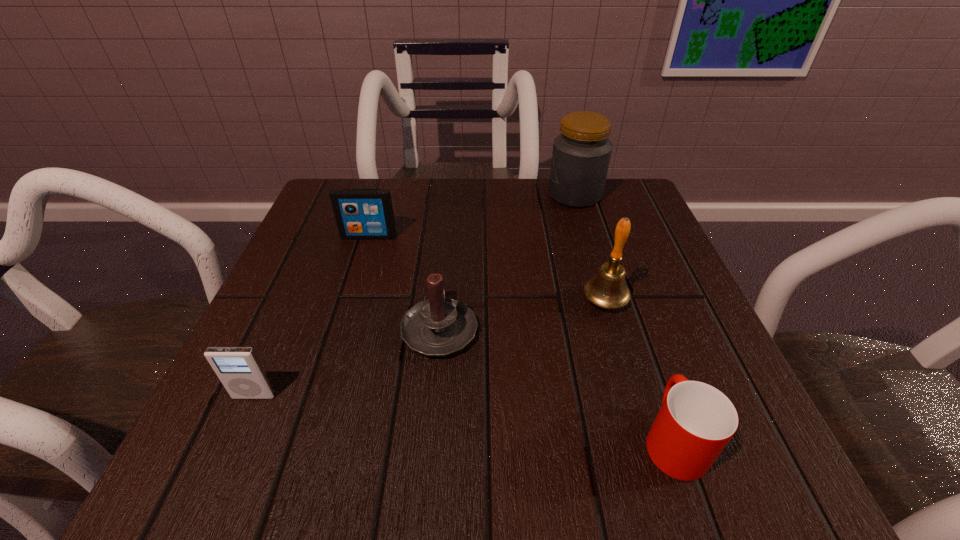
Image resolution: width=960 pixels, height=540 pixels. Find the location of `free space located 0.080m on the surface of the jar near the warning symbol`. free space located 0.080m on the surface of the jar near the warning symbol is located at coordinates (514, 194).

Where is `vacant space located 0.300m on the back of the bell`? This screenshot has width=960, height=540. vacant space located 0.300m on the back of the bell is located at coordinates (574, 197).

At what (x,y) coordinates should I click in order to perform the action: click on free location located 0.300m on the side of the candle with the handle loop. Please return your answer as a coordinate pair (x, y). The height and width of the screenshot is (540, 960). Looking at the image, I should click on (451, 205).

You are a GUI agent. You are given a task and a screenshot of the screen. Output one action in this format:
    pyautogui.click(x=<x>, y=<y>)
    Task: Click on the vacant region located 0.220m on the side of the candle with the handle loop
    
    Given the screenshot: What is the action you would take?
    pyautogui.click(x=449, y=225)

At what (x,y) coordinates should I click in order to perform the action: click on free space located 0.200m on the side of the candle with the handle loop. Please return your answer as a coordinate pair (x, y). Looking at the image, I should click on (448, 231).

Find the location of a particular element. vacant position located on the front screen of the right iPod is located at coordinates (327, 369).

This screenshot has height=540, width=960. I want to click on free space located 0.110m on the front-facing side of the nearer iPod, so click(218, 479).

In order to click on blank space located on the side of the cup with the handle in this screenshot , I will do `click(615, 272)`.

The height and width of the screenshot is (540, 960). In order to click on free spot located 0.110m on the side of the cup with the handle in this screenshot , I will do `click(639, 342)`.

The height and width of the screenshot is (540, 960). What are the coordinates of `free space located on the side of the cup with the handle` in the screenshot? It's located at [x=637, y=338].